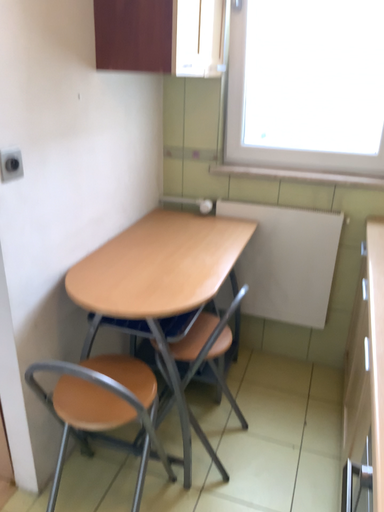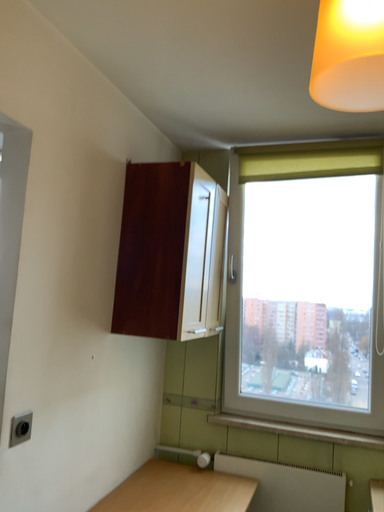
Question: How did the camera likely rotate when shooting the video?

Choices:
 (A) rotated downward
 (B) rotated upward

Answer: (B)